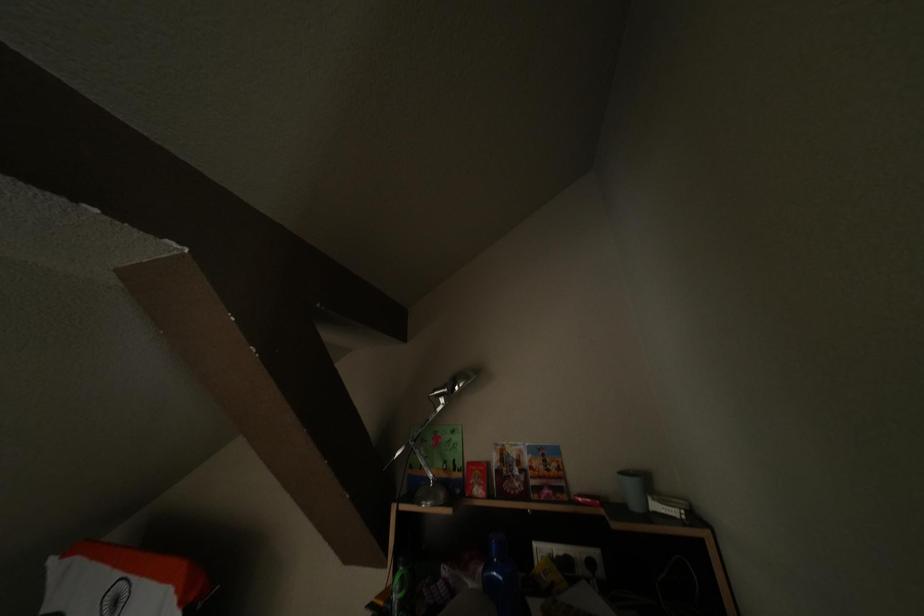
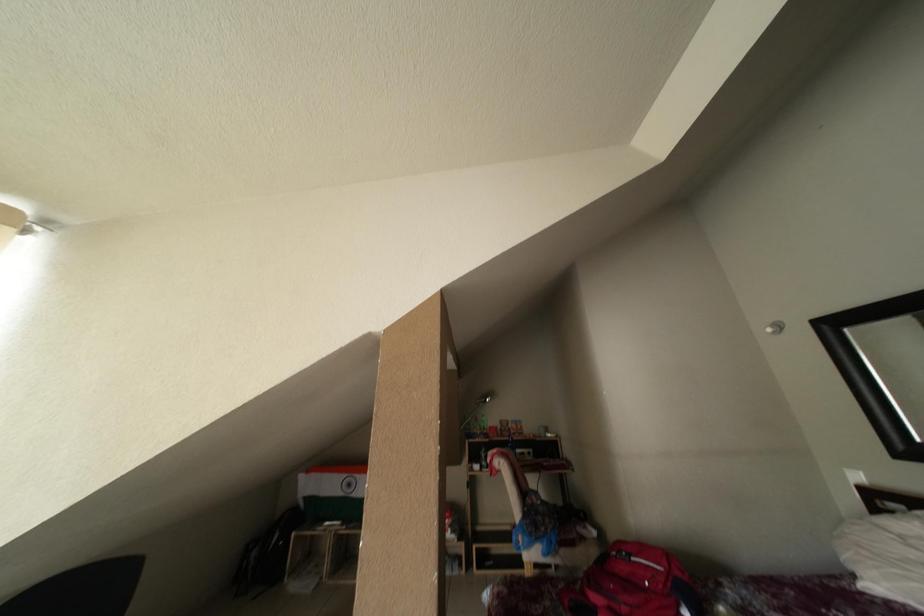
The images are taken continuously from a first-person perspective. In which direction are you moving?

The movement direction of the cameraman is left, backward.